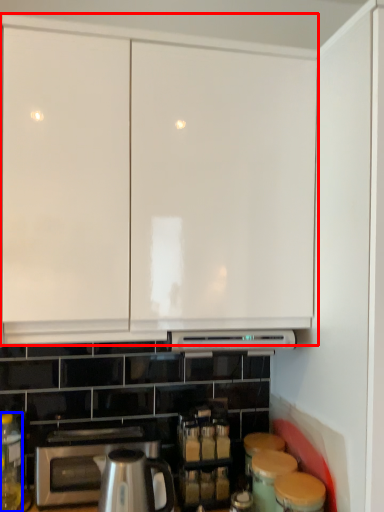
Question: Among these objects, which one is nearest to the camera, cabinetry (highlighted by a red box) or bottle (highlighted by a blue box)?

Choices:
 (A) cabinetry
 (B) bottle

Answer: (A)